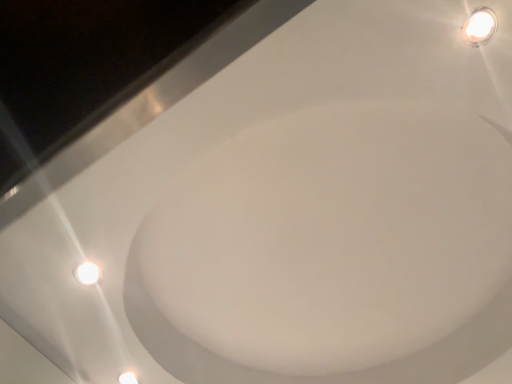
Question: Considering the relative sizes of white glossy bath at upper center and white glossy light fixture at upper right in the image provided, is white glossy bath at upper center bigger than white glossy light fixture at upper right?

Choices:
 (A) yes
 (B) no

Answer: (A)

Question: Is white glossy bath at upper center not within white glossy light fixture at upper right?

Choices:
 (A) no
 (B) yes

Answer: (B)

Question: Is white glossy bath at upper center next to white glossy light fixture at upper right?

Choices:
 (A) yes
 (B) no

Answer: (B)

Question: From the image's perspective, is white glossy bath at upper center located beneath white glossy light fixture at upper right?

Choices:
 (A) yes
 (B) no

Answer: (A)

Question: Can you confirm if white glossy bath at upper center is shorter than white glossy light fixture at upper right?

Choices:
 (A) yes
 (B) no

Answer: (A)

Question: From a real-world perspective, is white glossy bath at upper center on white glossy light fixture at upper right?

Choices:
 (A) yes
 (B) no

Answer: (A)

Question: Can you confirm if white glossy light fixture at upper right is shorter than white glossy bath at upper center?

Choices:
 (A) no
 (B) yes

Answer: (A)

Question: From the image's perspective, is white glossy light fixture at upper right located above white glossy bath at upper center?

Choices:
 (A) yes
 (B) no

Answer: (A)

Question: Are white glossy light fixture at upper right and white glossy bath at upper center making contact?

Choices:
 (A) no
 (B) yes

Answer: (A)

Question: From the image's perspective, is white glossy light fixture at upper right located beneath white glossy bath at upper center?

Choices:
 (A) yes
 (B) no

Answer: (B)

Question: Is white glossy light fixture at upper right completely or partially outside of white glossy bath at upper center?

Choices:
 (A) no
 (B) yes

Answer: (B)

Question: Considering the relative sizes of white glossy light fixture at upper right and white glossy bath at upper center in the image provided, is white glossy light fixture at upper right smaller than white glossy bath at upper center?

Choices:
 (A) yes
 (B) no

Answer: (A)

Question: Considering the positions of white glossy bath at upper center and white glossy light fixture at upper right in the image, is white glossy bath at upper center taller or shorter than white glossy light fixture at upper right?

Choices:
 (A) short
 (B) tall

Answer: (A)